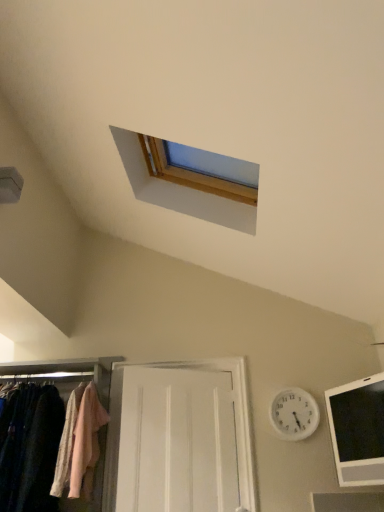
Question: Is matte fabric closet at lower left next to white wooden door at center?

Choices:
 (A) no
 (B) yes

Answer: (A)

Question: Does matte fabric closet at lower left appear on the right side of white wooden door at center?

Choices:
 (A) yes
 (B) no

Answer: (B)

Question: Does matte fabric closet at lower left have a greater height compared to white wooden door at center?

Choices:
 (A) no
 (B) yes

Answer: (A)

Question: Is matte fabric closet at lower left positioned with its back to white wooden door at center?

Choices:
 (A) yes
 (B) no

Answer: (B)

Question: Is white wooden door at center located within matte fabric closet at lower left?

Choices:
 (A) yes
 (B) no

Answer: (B)

Question: Based on their sizes in the image, would you say matte fabric closet at lower left is bigger or smaller than black glossy tablet at lower right?

Choices:
 (A) big
 (B) small

Answer: (A)

Question: From a real-world perspective, is matte fabric closet at lower left above or below black glossy tablet at lower right?

Choices:
 (A) above
 (B) below

Answer: (A)

Question: From the image's perspective, is matte fabric closet at lower left located above or below black glossy tablet at lower right?

Choices:
 (A) above
 (B) below

Answer: (B)

Question: Is matte fabric closet at lower left inside or outside of black glossy tablet at lower right?

Choices:
 (A) outside
 (B) inside

Answer: (A)

Question: Is white plastic clock at upper center in front of or behind light pink fabric at left in the image?

Choices:
 (A) front
 (B) behind

Answer: (B)

Question: Does point (296, 436) appear closer or farther from the camera than point (69, 471)?

Choices:
 (A) closer
 (B) farther

Answer: (B)

Question: In terms of width, does white plastic clock at upper center look wider or thinner when compared to light pink fabric at left?

Choices:
 (A) wide
 (B) thin

Answer: (B)

Question: Considering the positions of white plastic clock at upper center and light pink fabric at left in the image, is white plastic clock at upper center taller or shorter than light pink fabric at left?

Choices:
 (A) tall
 (B) short

Answer: (B)

Question: Considering their positions, is white plastic clock at upper center located in front of or behind white wooden door at center?

Choices:
 (A) behind
 (B) front

Answer: (A)

Question: From the image's perspective, is white plastic clock at upper center located above or below white wooden door at center?

Choices:
 (A) above
 (B) below

Answer: (A)